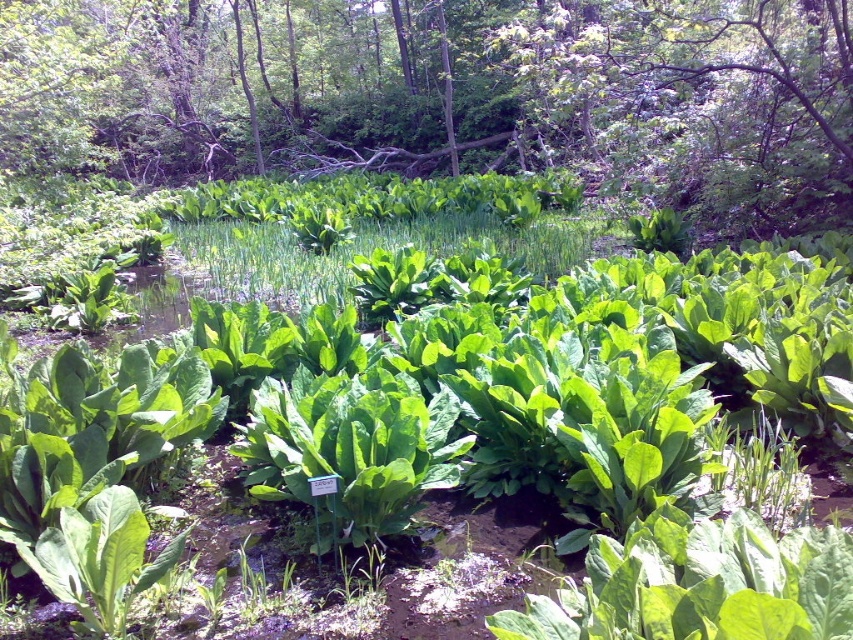
Question: Does green leafy plant at center appear on the right side of green leafy grass at center?

Choices:
 (A) yes
 (B) no

Answer: (B)

Question: Is green leafy plant at center bigger than green leafy grass at center?

Choices:
 (A) no
 (B) yes

Answer: (B)

Question: Is green leafy plant at center to the right of green leafy grass at center from the viewer's perspective?

Choices:
 (A) yes
 (B) no

Answer: (B)